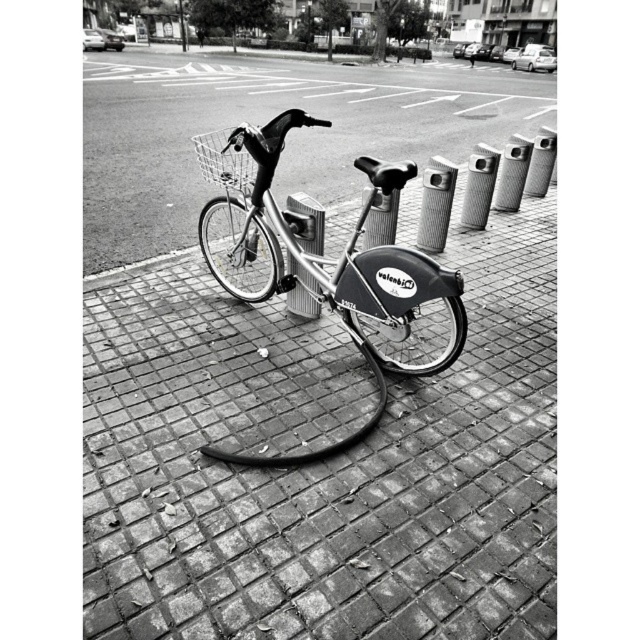
You are standing at the point marked by the bicycle in the image. You want to walk to the brick pavement at center located at point (323, 464). Which direction should you face to walk straight towards it?

You should face the center direction to walk straight towards the brick pavement at center located at point (323, 464).